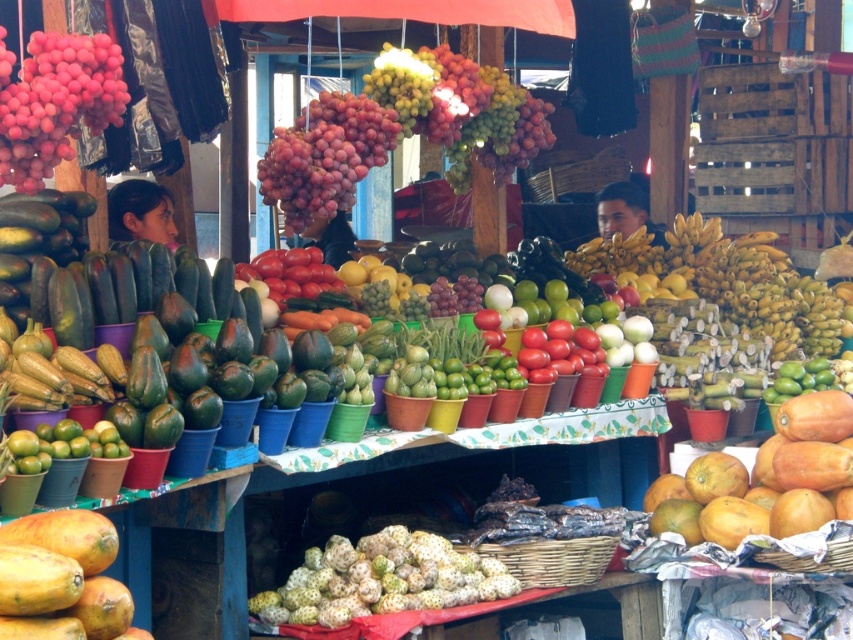
Question: Which object is farther from the camera taking this photo?

Choices:
 (A) ripe papaya at center
 (B) matte green papaya at left
 (C) green rough durian at center

Answer: (B)

Question: Is shiny red grapes at center wider than shiny red tomatoes at center?

Choices:
 (A) yes
 (B) no

Answer: (A)

Question: Does green rough durian at center appear under shiny red grapes at center?

Choices:
 (A) no
 (B) yes

Answer: (B)

Question: Can you confirm if green rough durian at center is positioned to the left of yellow papaya at center?

Choices:
 (A) yes
 (B) no

Answer: (B)

Question: Among these objects, which one is nearest to the camera?

Choices:
 (A) matte green papaya at left
 (B) ripe papaya at center
 (C) shiny red tomatoes at center
 (D) green rough durian at center

Answer: (D)

Question: Which of the following is the closest to the observer?

Choices:
 (A) (119, 189)
 (B) (850, 516)

Answer: (B)